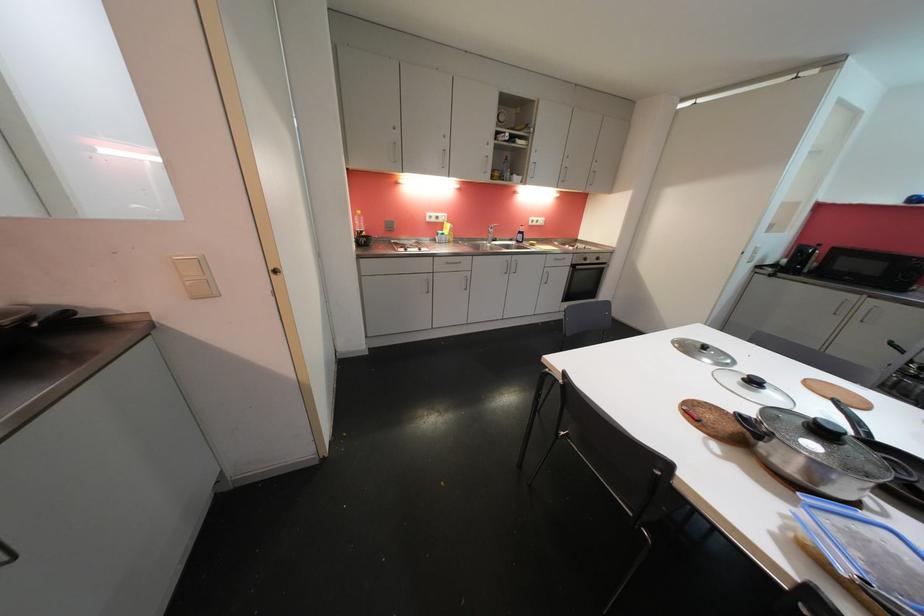
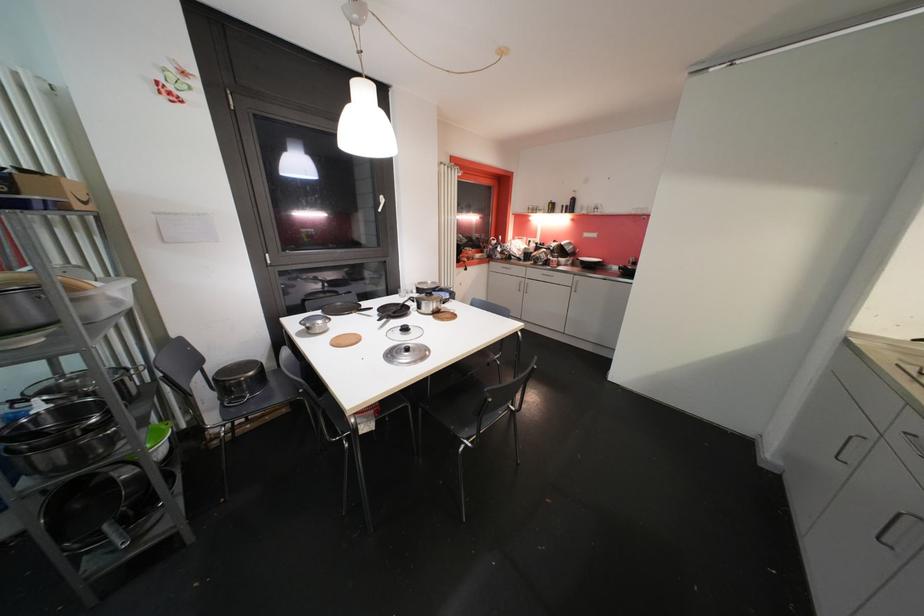
In the second image, find the point that corresponds to point (759, 385) in the first image.

(410, 331)